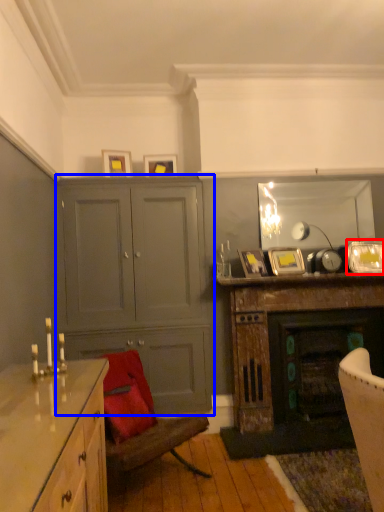
Question: Which object appears farthest to the camera in this image, picture frame (highlighted by a red box) or cabinetry (highlighted by a blue box)?

Choices:
 (A) picture frame
 (B) cabinetry

Answer: (A)